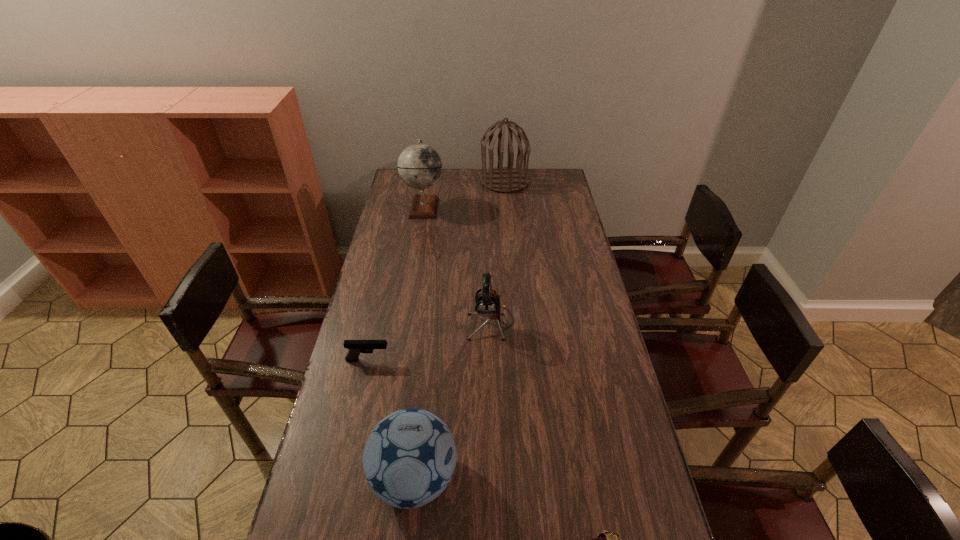
You are a GUI agent. You are given a task and a screenshot of the screen. Output one action in this format:
    pyautogui.click(x=<x>, y=<y>)
    Task: Click on the vacant space that's between the third farthest object and the pistol
    The image size is (960, 540).
    Given the screenshot: What is the action you would take?
    pyautogui.click(x=429, y=341)

You are a GUI agent. You are given a task and a screenshot of the screen. Output one action in this format:
    pyautogui.click(x=<x>, y=<y>)
    Task: Click on the free space between the farthest object and the soccer ball
    
    Given the screenshot: What is the action you would take?
    pyautogui.click(x=460, y=329)

The width and height of the screenshot is (960, 540). Identify the location of free space between the earphone and the birdcage. (497, 252).

This screenshot has width=960, height=540. Find the location of `vacant space that's between the globe and the third farthest object`. vacant space that's between the globe and the third farthest object is located at coordinates (458, 265).

Locate an element on the screen. This screenshot has height=540, width=960. blank region between the earphone and the pistol is located at coordinates (429, 341).

Identify which object is the second nearest to the pistol. Please provide its 2D coordinates. Your answer should be formatted as a tuple, i.e. [(x, y)], where the tuple contains the x and y coordinates of a point satisfying the conditions above.

[(409, 458)]

Find the location of a particular element. object that is the fourth closest to the crown is located at coordinates (419, 165).

This screenshot has width=960, height=540. What are the coordinates of `vacant space that satisfies the following two spatial constraints: 1. on the front side of the farthest object; 2. on the front-facing side of the third nearest object` in the screenshot? It's located at (519, 360).

This screenshot has width=960, height=540. Find the location of `free space in the image that satisfies the following two spatial constraints: 1. at the equator of the fourth nearest object; 2. on the left side of the fifth nearest object`. free space in the image that satisfies the following two spatial constraints: 1. at the equator of the fourth nearest object; 2. on the left side of the fifth nearest object is located at coordinates (404, 323).